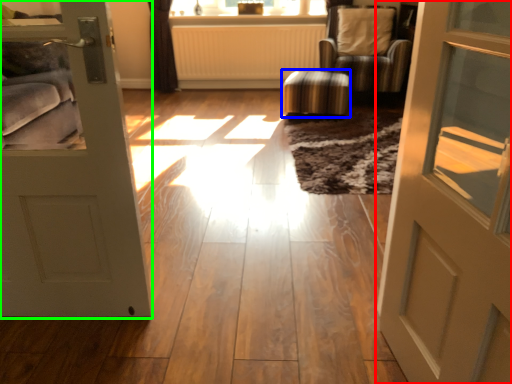
Question: Which object is the farthest from door (highlighted by a red box)? Choose among these: stool (highlighted by a blue box) or door (highlighted by a green box).

Choices:
 (A) stool
 (B) door

Answer: (A)